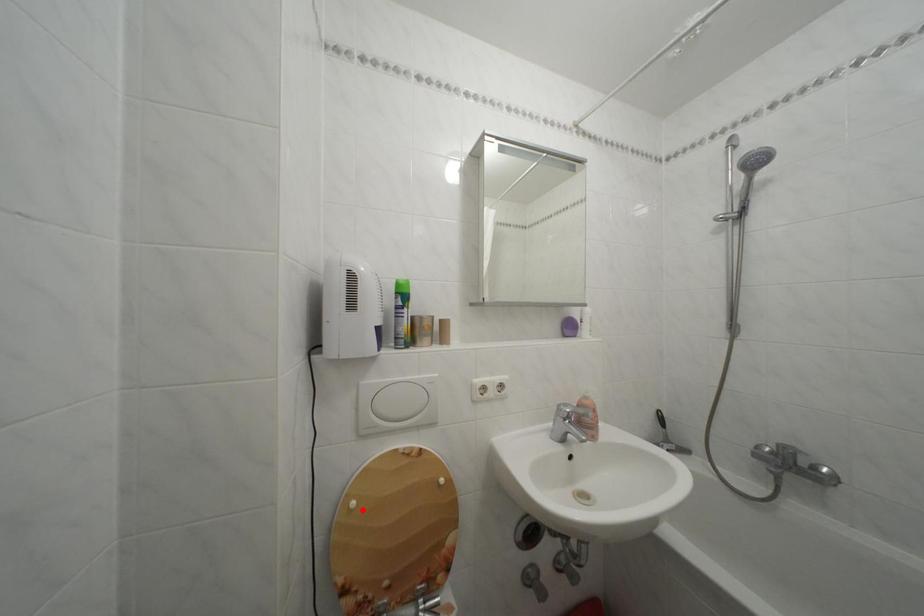
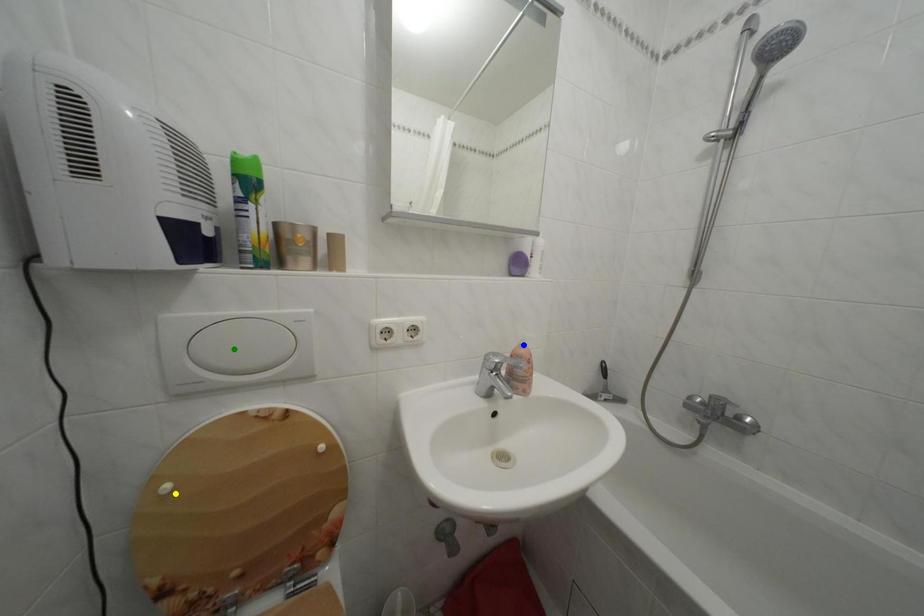
Question: I am providing you with two images of the same scene from different viewpoints. A red point is marked on the first image. You are given multiple points on the second image. Which mark in image 2 goes with the point in image 1?

Choices:
 (A) green point
 (B) yellow point
 (C) blue point

Answer: (B)